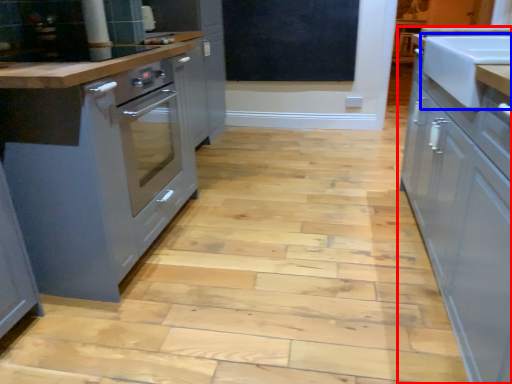
Question: Among these objects, which one is farthest to the camera, cabinetry (highlighted by a red box) or sink (highlighted by a blue box)?

Choices:
 (A) cabinetry
 (B) sink

Answer: (B)